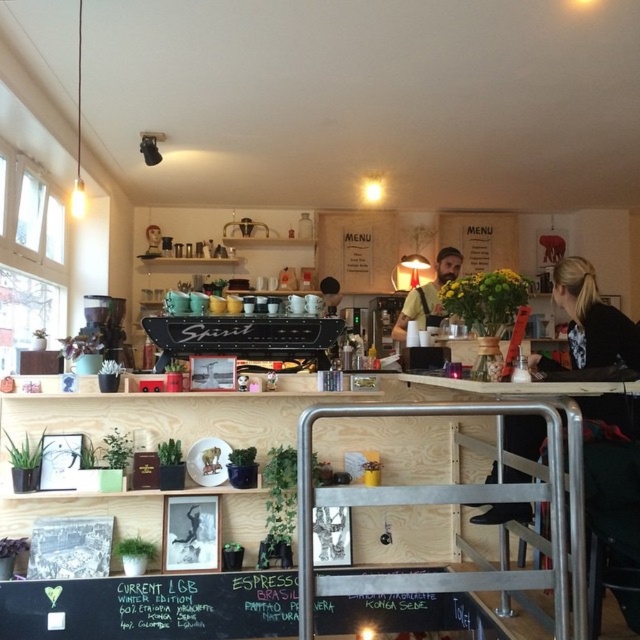
Is black fabric jacket at upper right above bearded man with beard at center?

Incorrect, black fabric jacket at upper right is not positioned above bearded man with beard at center.

Measure the distance from black fabric jacket at upper right to bearded man with beard at center.

The distance of black fabric jacket at upper right from bearded man with beard at center is 4.47 feet.

Is point (580, 276) closer to camera compared to point (422, 314)?

Yes, it is in front of point (422, 314).

You are a GUI agent. You are given a task and a screenshot of the screen. Output one action in this format:
    pyautogui.click(x=<x>, y=<y>)
    Task: Click on the black fabric jacket at upper right
    The height and width of the screenshot is (640, 640).
    Given the screenshot: What is the action you would take?
    pyautogui.click(x=593, y=321)

Find the location of a particular element. black chalkboard at lower center is located at coordinates (152, 605).

Is black chalkboard at lower center closer to camera compared to metallic silver table at center?

No.

The height and width of the screenshot is (640, 640). I want to click on black chalkboard at lower center, so click(152, 605).

Is black chalkboard at lower center thinner than bearded man with beard at center?

No, black chalkboard at lower center is not thinner than bearded man with beard at center.

Between point (0, 582) and point (419, 328), which one is positioned in front?

Point (0, 582) is in front.

Is point (291, 572) less distant than point (422, 301)?

Yes, point (291, 572) is closer to viewer.

This screenshot has height=640, width=640. I want to click on black chalkboard at lower center, so click(152, 605).